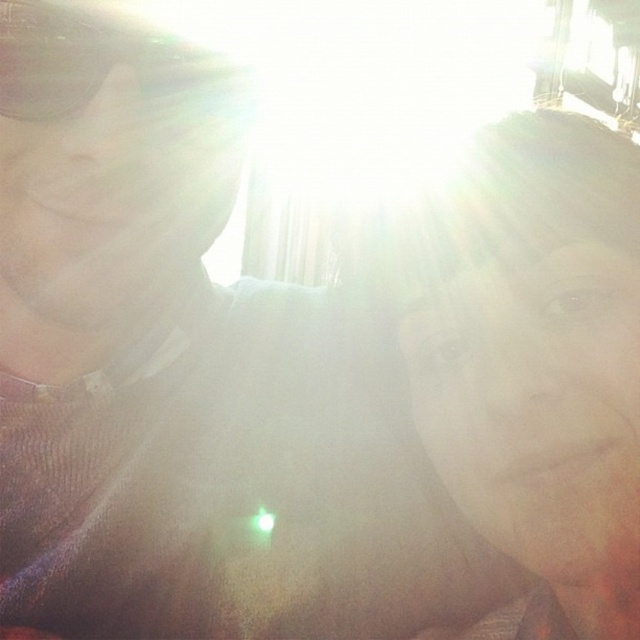
Consider the image. You are taking a selfie in bright sunlight. You notice two items in your photo. One is the smooth skin face at right and the other is the matte black goggles at upper left. According to the image, which item is positioned lower?

The smooth skin face at right is located below the matte black goggles at upper left, so the smooth skin face at right is positioned lower.

You are taking a selfie and want to ensure the smooth skin face at right is centered in the frame. Given its current position at point coordinates, is it already centered?

The smooth skin face at right is located at coordinates point (531, 353), which is not the center of the frame. To center it, you would need to adjust the camera angle so that the face is positioned at point (320, 320).

You are holding a camera and want to take a selfie where the smooth skin face at right is clearly visible without being washed out by the sunlight. Based on the scene description, what adjustment should you make to your camera position or settings?

Move the camera closer to the smooth skin face at right so that it is 14.42 inches away, as the current distance may be causing overexposure due to the bright sunlight.